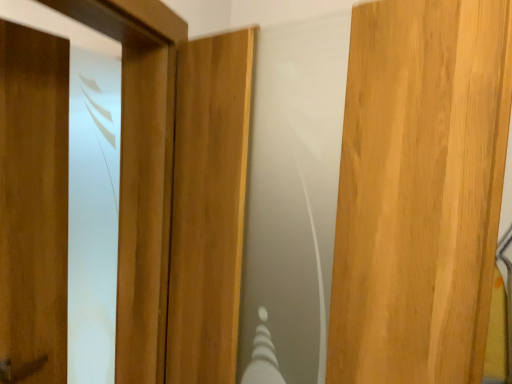
What do you see at coordinates (34, 200) in the screenshot? The image size is (512, 384). I see `satin wood door at left` at bounding box center [34, 200].

This screenshot has width=512, height=384. Identify the location of satin wood door at left. (34, 200).

This screenshot has height=384, width=512. Find the location of `satin wood door at left`. satin wood door at left is located at coordinates (34, 200).